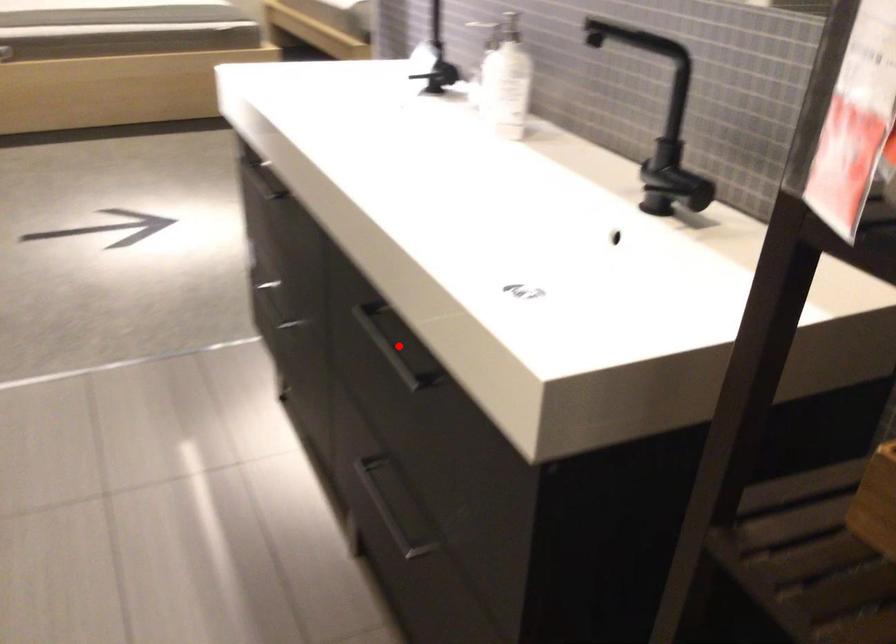
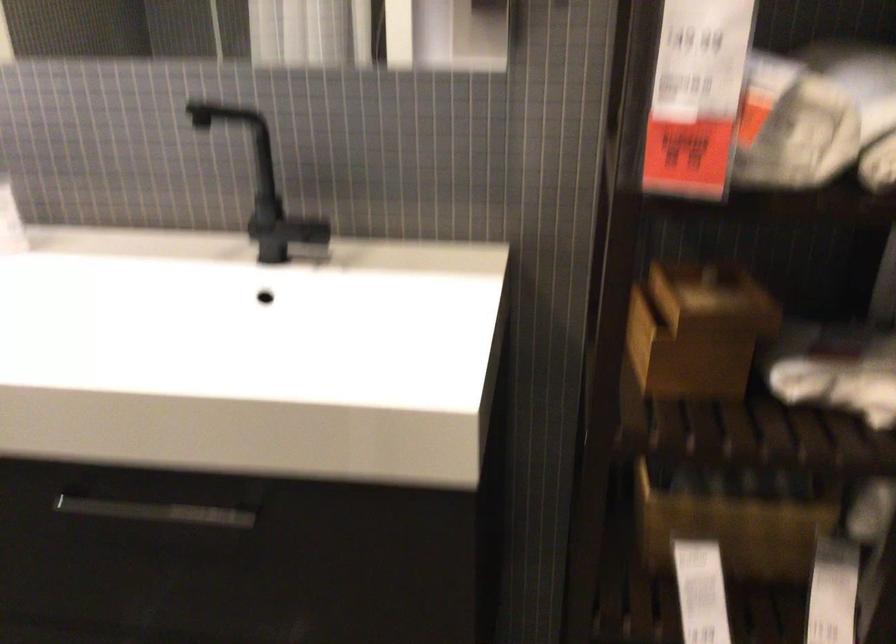
Find the pixel in the second image that matches the highlighted location in the first image.

(152, 509)